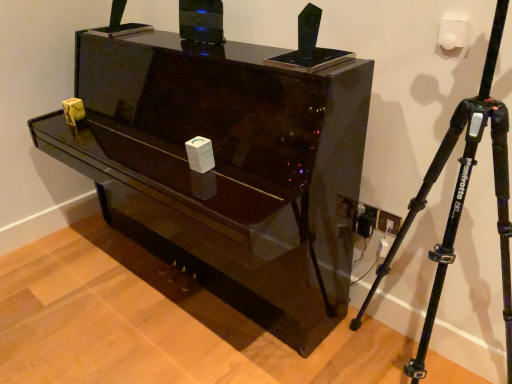
In order to face black matte tripod at right, should I rotate leftwards or rightwards?

Rotate right and turn 22.115 degrees.

The width and height of the screenshot is (512, 384). What do you see at coordinates (463, 198) in the screenshot?
I see `black matte tripod at right` at bounding box center [463, 198].

Locate an element on the screen. The width and height of the screenshot is (512, 384). black matte tripod at right is located at coordinates (463, 198).

Measure the distance between glossy black piano at center and camera.

The depth of glossy black piano at center is 1.15 meters.

In order to click on glossy black piano at center in this screenshot , I will do `click(226, 169)`.

Describe the element at coordinates (226, 169) in the screenshot. I see `glossy black piano at center` at that location.

In order to click on black matte tripod at right in this screenshot , I will do `click(463, 198)`.

Is glossy black piano at center at the right side of black matte tripod at right?

Incorrect, glossy black piano at center is not on the right side of black matte tripod at right.

In the image, is glossy black piano at center positioned in front of or behind black matte tripod at right?

Clearly, glossy black piano at center is behind black matte tripod at right.

Does point (282, 229) lie behind point (360, 312)?

No, (282, 229) is closer to viewer.

From the image's perspective, is glossy black piano at center below black matte tripod at right?

Incorrect, from the image's perspective, glossy black piano at center is higher than black matte tripod at right.

From a real-world perspective, is glossy black piano at center on top of black matte tripod at right?

No, from a real-world perspective, glossy black piano at center is not over black matte tripod at right

Which object is thinner, glossy black piano at center or black matte tripod at right?

black matte tripod at right is thinner.

Is glossy black piano at center taller than black matte tripod at right?

Incorrect, the height of glossy black piano at center is not larger of that of black matte tripod at right.

In terms of size, does glossy black piano at center appear bigger or smaller than black matte tripod at right?

glossy black piano at center is bigger than black matte tripod at right.

Is glossy black piano at center inside or outside of black matte tripod at right?

glossy black piano at center exists outside the volume of black matte tripod at right.

Is glossy black piano at center directly adjacent to black matte tripod at right?

No, glossy black piano at center is not beside black matte tripod at right.

Is glossy black piano at center facing away from black matte tripod at right?

No.

Can you tell me how much glossy black piano at center and black matte tripod at right differ in facing direction?

glossy black piano at center and black matte tripod at right are facing 0.000599 degrees away from each other.

At what (x,y) coordinates should I click in order to perform the action: click on tripod located below the glossy black piano at center (from the image's perspective). Please return your answer as a coordinate pair (x, y). Looking at the image, I should click on (463, 198).

Does black matte tripod at right appear on the right side of glossy black piano at center?

Yes, black matte tripod at right is to the right of glossy black piano at center.

In the image, is black matte tripod at right positioned in front of or behind glossy black piano at center?

In the image, black matte tripod at right appears in front of glossy black piano at center.

Is point (450, 229) positioned behind point (292, 268)?

No, it is not.

From the image's perspective, is black matte tripod at right on top of glossy black piano at center?

Incorrect, from the image's perspective, black matte tripod at right is lower than glossy black piano at center.

From a real-world perspective, between black matte tripod at right and glossy black piano at center, who is vertically higher?

black matte tripod at right, from a real-world perspective.

Is black matte tripod at right wider than glossy black piano at center?

Incorrect, the width of black matte tripod at right does not surpass that of glossy black piano at center.

Between black matte tripod at right and glossy black piano at center, which one has less height?

Standing shorter between the two is glossy black piano at center.

Who is bigger, black matte tripod at right or glossy black piano at center?

Bigger between the two is glossy black piano at center.

Is black matte tripod at right inside or outside of glossy black piano at center?

black matte tripod at right is spatially situated outside glossy black piano at center.

Looking at this image, is black matte tripod at right directly adjacent to glossy black piano at center?

There is a gap between black matte tripod at right and glossy black piano at center.

Is black matte tripod at right aimed at glossy black piano at center?

No, black matte tripod at right is not oriented towards glossy black piano at center.

Can you tell me how much black matte tripod at right and glossy black piano at center differ in facing direction?

There is a 0.000599-degree angle between the facing directions of black matte tripod at right and glossy black piano at center.

Identify the location of tripod above the glossy black piano at center (from a real-world perspective). This screenshot has height=384, width=512. (463, 198).

Identify the location of tripod that is on the right side of glossy black piano at center. (463, 198).

Where is `furniture on the left of black matte tripod at right`? furniture on the left of black matte tripod at right is located at coordinates (226, 169).